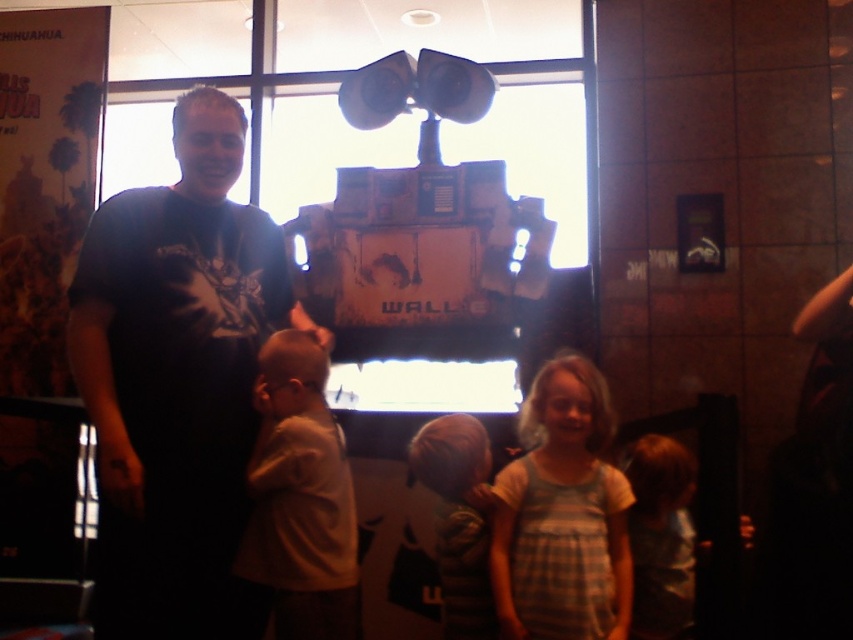
Can you confirm if striped fabric shirt at center is positioned to the left of light brown fabric shirt at lower right?

Indeed, striped fabric shirt at center is positioned on the left side of light brown fabric shirt at lower right.

Is striped fabric shirt at center thinner than light brown fabric shirt at lower right?

No.

What do you see at coordinates (457, 518) in the screenshot? The width and height of the screenshot is (853, 640). I see `striped fabric shirt at center` at bounding box center [457, 518].

Locate an element on the screen. striped fabric shirt at center is located at coordinates (457, 518).

This screenshot has width=853, height=640. Describe the element at coordinates (177, 374) in the screenshot. I see `black matte shirt at left` at that location.

Which is in front, point (143, 556) or point (676, 552)?

Positioned in front is point (143, 556).

Does point (154, 532) come in front of point (631, 512)?

Yes, it is.

Locate an element on the screen. black matte shirt at left is located at coordinates (177, 374).

Is black matte shirt at left below light brown fabric shirt at lower left?

No.

Is black matte shirt at left positioned in front of light brown fabric shirt at lower left?

Yes, black matte shirt at left is in front of light brown fabric shirt at lower left.

Which is in front, point (218, 628) or point (335, 486)?

Point (218, 628) is more forward.

You are a GUI agent. You are given a task and a screenshot of the screen. Output one action in this format:
    pyautogui.click(x=<x>, y=<y>)
    Task: Click on the black matte shirt at left
    
    Given the screenshot: What is the action you would take?
    pyautogui.click(x=177, y=374)